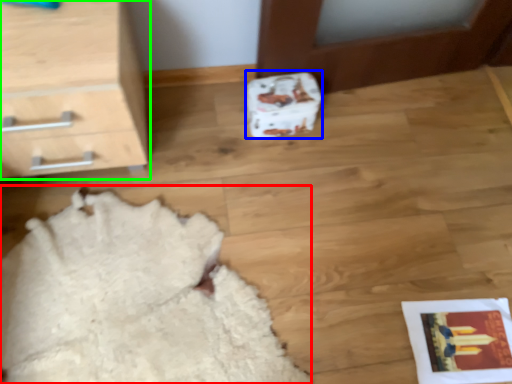
Question: Which object is the closest to the blanket (highlighted by a red box)? Choose among these: shoe box (highlighted by a blue box) or chest of drawers (highlighted by a green box).

Choices:
 (A) shoe box
 (B) chest of drawers

Answer: (B)